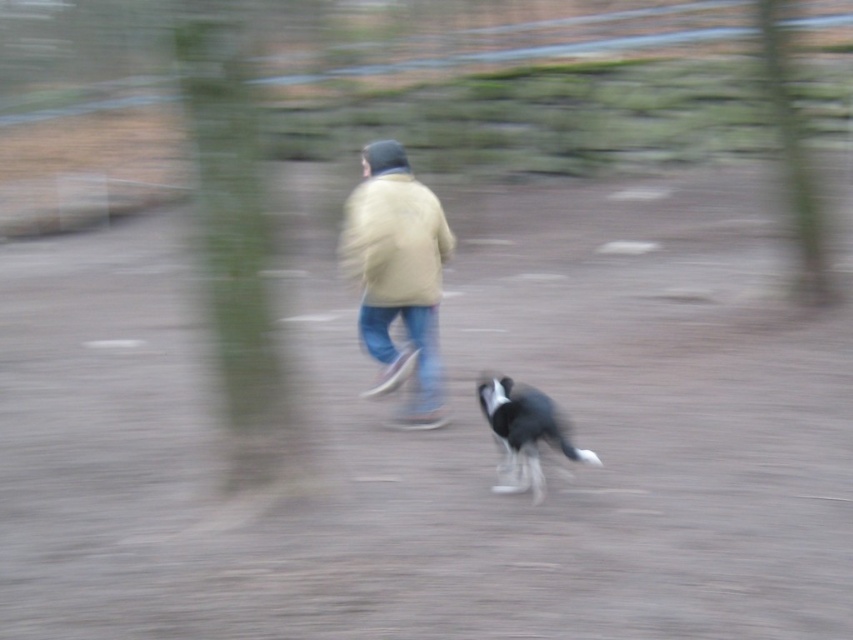
Is light beige jacket at center shorter than black and white fur dog at lower center?

No, light beige jacket at center is not shorter than black and white fur dog at lower center.

Can you confirm if light beige jacket at center is smaller than black and white fur dog at lower center?

Actually, light beige jacket at center might be larger than black and white fur dog at lower center.

Which is in front, point (401, 227) or point (508, 448)?

Point (508, 448)

Where is `light beige jacket at center`? Image resolution: width=853 pixels, height=640 pixels. light beige jacket at center is located at coordinates (393, 241).

Is light yellow jacket at center positioned in front of black and white fur dog at lower center?

No, it is not.

The height and width of the screenshot is (640, 853). In order to click on light yellow jacket at center in this screenshot , I will do `click(398, 275)`.

Between green leafy tree at upper center and green textured tree at upper right, which one is positioned higher?

green textured tree at upper right

Looking at this image, who is more distant from viewer, (210, 140) or (759, 49)?

Positioned behind is point (759, 49).

Is point (177, 24) behind point (802, 244)?

No, it is not.

Image resolution: width=853 pixels, height=640 pixels. In order to click on green leafy tree at upper center in this screenshot , I will do 236,259.